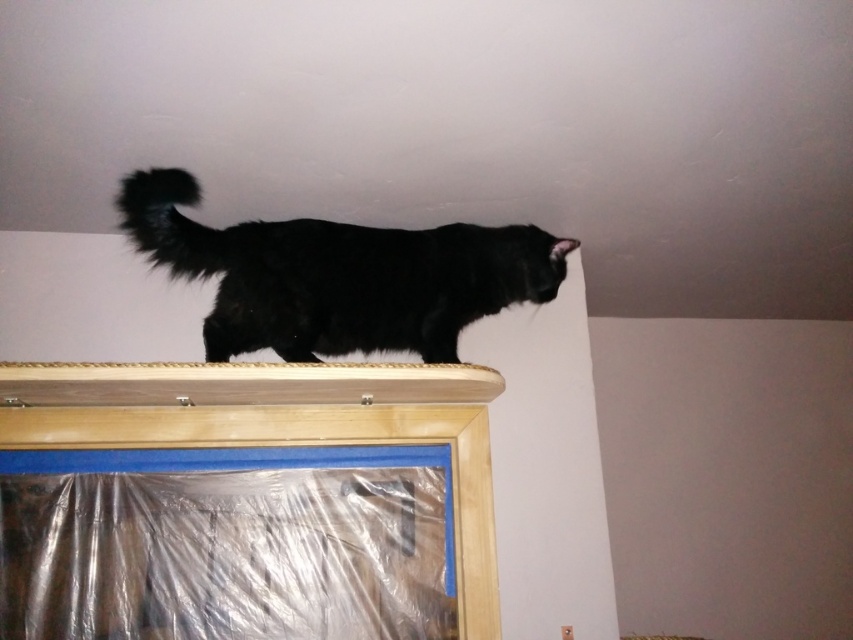
Question: Among these objects, which one is nearest to the camera?

Choices:
 (A) fluffy black tail at upper center
 (B) black fluffy cat at upper center

Answer: (A)

Question: Which point is farther from the camera taking this photo?

Choices:
 (A) click(x=403, y=323)
 (B) click(x=177, y=221)

Answer: (A)

Question: Which point is closer to the camera?

Choices:
 (A) black fluffy cat at upper center
 (B) fluffy black tail at upper center

Answer: (B)

Question: Does black fluffy cat at upper center lie in front of fluffy black tail at upper center?

Choices:
 (A) no
 (B) yes

Answer: (A)

Question: Does black fluffy cat at upper center come behind fluffy black tail at upper center?

Choices:
 (A) no
 (B) yes

Answer: (B)

Question: Is black fluffy cat at upper center positioned before fluffy black tail at upper center?

Choices:
 (A) yes
 (B) no

Answer: (B)